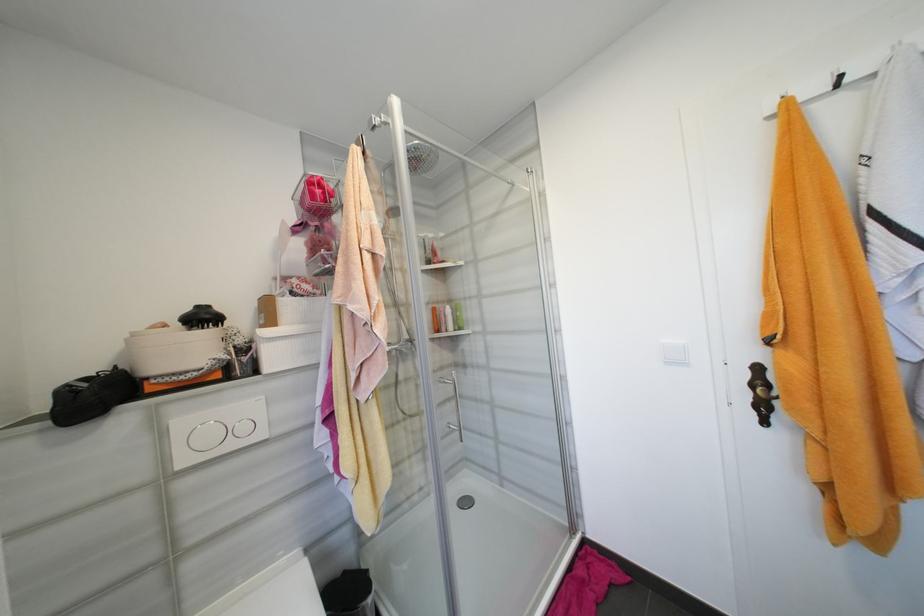
Where is `metal shower handle`? Image resolution: width=924 pixels, height=616 pixels. metal shower handle is located at coordinates (454, 402).